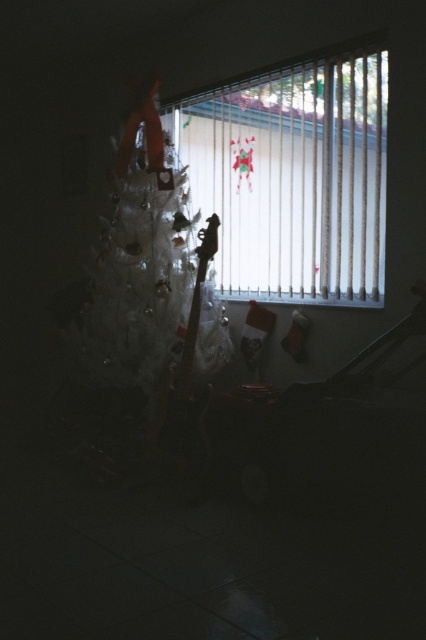
Consider the image. You are a guest in the room and want to see the outside garden through the window. The white plastic blinds at upper right and the white frosted christmas tree at center are in your way. Which object should you move to get a clear view?

You should move the white plastic blinds at upper right because it is positioned on the right side of the white frosted christmas tree at center, so moving it would allow you to see through the window to the garden outside.

You are a delivery person trying to place a 24 inches wide package between the white plastic blinds at upper right and the white frosted christmas tree at center. Can the package fit in that space?

The distance between the white plastic blinds at upper right and the white frosted christmas tree at center is 21.63 inches, which is less than the 24 inches width of the package. Therefore, the package cannot fit in that space.